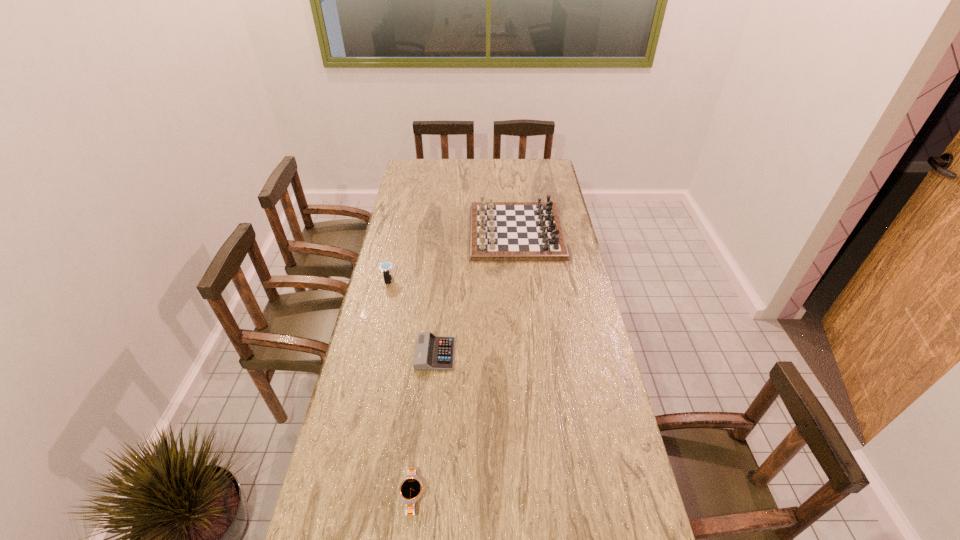
The width and height of the screenshot is (960, 540). Identify the location of the tallest object. (499, 231).

The width and height of the screenshot is (960, 540). I want to click on the rightmost object, so click(499, 231).

Where is `the taller watch`? the taller watch is located at coordinates (385, 268).

At what (x,y) coordinates should I click in order to perform the action: click on the left watch. Please return your answer as a coordinate pair (x, y). The image size is (960, 540). Looking at the image, I should click on (385, 268).

You are a GUI agent. You are given a task and a screenshot of the screen. Output one action in this format:
    pyautogui.click(x=<x>, y=<y>)
    Task: Click on the nearest object
    The image size is (960, 540).
    Given the screenshot: What is the action you would take?
    pyautogui.click(x=410, y=490)

Locate an element on the screen. the right watch is located at coordinates (410, 490).

Where is `calculator`? Image resolution: width=960 pixels, height=540 pixels. calculator is located at coordinates (432, 352).

Locate an element on the screen. Image resolution: width=960 pixels, height=540 pixels. vacant space located from the player's perspective of the chessboard is located at coordinates (456, 231).

The image size is (960, 540). I want to click on vacant space located 0.320m from the player's perspective of the chessboard, so click(x=396, y=231).

This screenshot has height=540, width=960. Find the location of `free location located from the player's perspective of the chessboard`. free location located from the player's perspective of the chessboard is located at coordinates (418, 231).